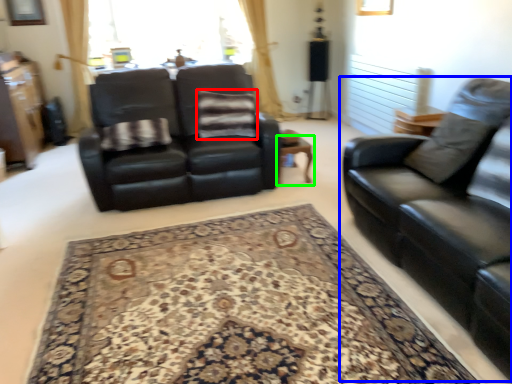
Question: Which object is the closest to the pillow (highlighted by a red box)? Choose among these: studio couch (highlighted by a blue box) or table (highlighted by a green box).

Choices:
 (A) studio couch
 (B) table

Answer: (B)